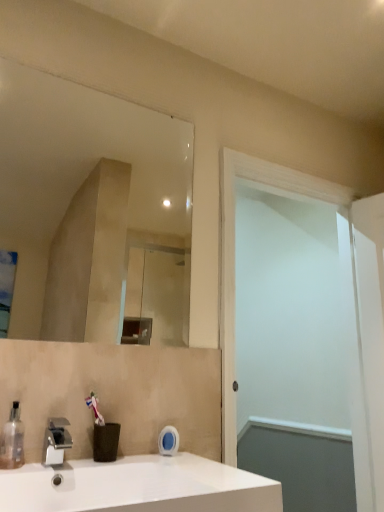
Locate an element on the screen. This screenshot has height=512, width=384. silver metallic faucet at lower left is located at coordinates (56, 441).

Describe the element at coordinates (12, 440) in the screenshot. I see `transparent plastic soap dispenser at lower left` at that location.

This screenshot has width=384, height=512. What do you see at coordinates (93, 200) in the screenshot?
I see `clear glass mirror at upper center` at bounding box center [93, 200].

I want to click on white glossy sink at lower left, so coord(138,486).

This screenshot has height=512, width=384. I want to click on silver metallic faucet at lower left, so click(56, 441).

Considering the positions of objects silver metallic faucet at lower left and white glossy sink at lower left in the image provided, who is more to the right, silver metallic faucet at lower left or white glossy sink at lower left?

From the viewer's perspective, white glossy sink at lower left appears more on the right side.

Does silver metallic faucet at lower left have a greater width compared to white glossy sink at lower left?

In fact, silver metallic faucet at lower left might be narrower than white glossy sink at lower left.

Which point is more distant from viewer, (52,458) or (151,500)?

Positioned behind is point (52,458).

Considering the sizes of objects silver metallic faucet at lower left and white glossy sink at lower left in the image provided, who is bigger, silver metallic faucet at lower left or white glossy sink at lower left?

Bigger between the two is white glossy sink at lower left.

Is white glossy sink at lower left outside of silver metallic faucet at lower left?

Yes, white glossy sink at lower left is not within silver metallic faucet at lower left.

Which object is more forward, white glossy sink at lower left or silver metallic faucet at lower left?

white glossy sink at lower left is in front.

Which of these two, white glossy sink at lower left or silver metallic faucet at lower left, stands shorter?

Standing shorter between the two is silver metallic faucet at lower left.

Which of these two, white glossy sink at lower left or silver metallic faucet at lower left, is smaller?

Smaller between the two is silver metallic faucet at lower left.

Is clear glass mirror at upper center facing away from white matte screen door at right?

clear glass mirror at upper center does not have its back to white matte screen door at right.

In terms of height, does clear glass mirror at upper center look taller or shorter compared to white matte screen door at right?

Clearly, clear glass mirror at upper center is shorter compared to white matte screen door at right.

From the image's perspective, relative to white matte screen door at right, is clear glass mirror at upper center above or below?

Clearly, from the image's perspective, clear glass mirror at upper center is above white matte screen door at right.

Which of these two, transparent plastic soap dispenser at lower left or clear glass mirror at upper center, is bigger?

Bigger between the two is clear glass mirror at upper center.

Is clear glass mirror at upper center completely or partially inside transparent plastic soap dispenser at lower left?

Definitely not — clear glass mirror at upper center is not inside transparent plastic soap dispenser at lower left.

Is point (11, 455) more distant than point (95, 221)?

No, (11, 455) is in front of (95, 221).

Who is more distant, transparent plastic soap dispenser at lower left or clear glass mirror at upper center?

clear glass mirror at upper center is more distant.

From the image's perspective, between white matte screen door at right and white glossy sink at lower left, which one is located above?

From the image's view, white matte screen door at right is above.

At what (x,y) coordinates should I click in order to perform the action: click on screen door to the right of white glossy sink at lower left. Please return your answer as a coordinate pair (x, y). The image size is (384, 512). Looking at the image, I should click on (234, 258).

Considering the relative sizes of white matte screen door at right and white glossy sink at lower left in the image provided, is white matte screen door at right shorter than white glossy sink at lower left?

No.

This screenshot has width=384, height=512. Find the location of `soap dispenser located behind the white glossy sink at lower left`. soap dispenser located behind the white glossy sink at lower left is located at coordinates (12, 440).

Considering the sizes of objects transparent plastic soap dispenser at lower left and white glossy sink at lower left in the image provided, who is bigger, transparent plastic soap dispenser at lower left or white glossy sink at lower left?

white glossy sink at lower left.

Which point is more distant from viewer, (11,441) or (235,489)?

The point (11,441) is farther from the camera.

Considering the positions of objects clear glass mirror at upper center and white glossy sink at lower left in the image provided, who is more to the right, clear glass mirror at upper center or white glossy sink at lower left?

Positioned to the right is white glossy sink at lower left.

Does point (189, 181) appear closer or farther from the camera than point (93, 497)?

Point (189, 181).

Is white glossy sink at lower left at the back of clear glass mirror at upper center?

No, clear glass mirror at upper center is not facing the opposite direction of white glossy sink at lower left.

Looking at this image, considering the sizes of objects clear glass mirror at upper center and white glossy sink at lower left in the image provided, who is bigger, clear glass mirror at upper center or white glossy sink at lower left?

white glossy sink at lower left.

Find the location of a particular element. tap behind the white glossy sink at lower left is located at coordinates (56, 441).

The height and width of the screenshot is (512, 384). Find the location of `sink located below the silver metallic faucet at lower left (from the image's perspective)`. sink located below the silver metallic faucet at lower left (from the image's perspective) is located at coordinates (138, 486).

Estimate the real-world distances between objects in this image. Which object is further from clear glass mirror at upper center, transparent plastic soap dispenser at lower left or white matte screen door at right?

transparent plastic soap dispenser at lower left.

Looking at the image, which one is located further to transparent plastic soap dispenser at lower left, silver metallic faucet at lower left or white glossy sink at lower left?

white glossy sink at lower left lies further to transparent plastic soap dispenser at lower left than the other object.

Estimate the real-world distances between objects in this image. Which object is further from white glossy sink at lower left, silver metallic faucet at lower left or transparent plastic soap dispenser at lower left?

transparent plastic soap dispenser at lower left is further to white glossy sink at lower left.

Which object lies further to the anchor point white matte screen door at right, transparent plastic soap dispenser at lower left or clear glass mirror at upper center?

Based on the image, clear glass mirror at upper center appears to be further to white matte screen door at right.

Consider the image. Based on their spatial positions, is white matte screen door at right or white glossy sink at lower left closer to transparent plastic soap dispenser at lower left?

Based on the image, white glossy sink at lower left appears to be nearer to transparent plastic soap dispenser at lower left.

In the scene shown: Which object lies further to the anchor point clear glass mirror at upper center, white glossy sink at lower left or white matte screen door at right?

white glossy sink at lower left is positioned further to the anchor clear glass mirror at upper center.

From the image, which object appears to be farther from transparent plastic soap dispenser at lower left, silver metallic faucet at lower left or clear glass mirror at upper center?

clear glass mirror at upper center.

Considering their positions, is white glossy sink at lower left positioned closer to transparent plastic soap dispenser at lower left than white matte screen door at right?

white glossy sink at lower left is closer to transparent plastic soap dispenser at lower left.

The width and height of the screenshot is (384, 512). In order to click on sink between transparent plastic soap dispenser at lower left and white matte screen door at right in this screenshot , I will do `click(138, 486)`.

The width and height of the screenshot is (384, 512). In order to click on tap between transparent plastic soap dispenser at lower left and white matte screen door at right in the horizontal direction in this screenshot , I will do `click(56, 441)`.

You are a GUI agent. You are given a task and a screenshot of the screen. Output one action in this format:
    pyautogui.click(x=<x>, y=<y>)
    Task: Click on the mirror between silver metallic faucet at lower left and white matte screen door at right
    The width and height of the screenshot is (384, 512).
    Given the screenshot: What is the action you would take?
    pyautogui.click(x=93, y=200)

What are the coordinates of `sink between clear glass mirror at upper center and white matte screen door at right` in the screenshot? It's located at (138, 486).